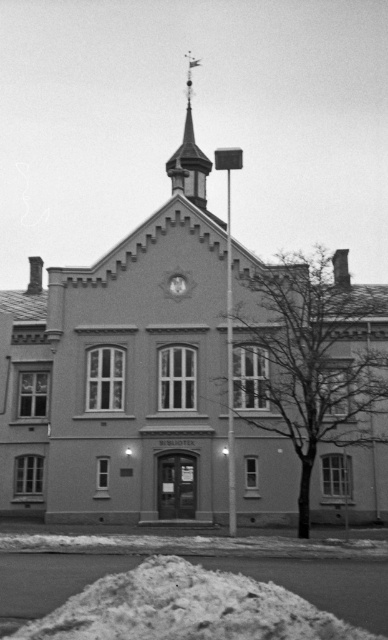
You are standing in front of the BIBLIOTEK building and notice the white powdery snow at lower center and the metallic clock at center. Which object is taller?

The white powdery snow at lower center is taller than the metallic clock at center.

You are an architect inspecting the building facade. You notice the polished brass spire at upper center and the metallic clock at center. Which object is larger in size?

The polished brass spire at upper center is bigger than the metallic clock at center, so the polished brass spire at upper center is larger in size.

You are an architect analyzing the building facade. You need to determine which object is taller between the polished brass spire at upper center and the metallic clock at center. Based on the building design, which one is taller?

The polished brass spire at upper center is much taller than the metallic clock at center.